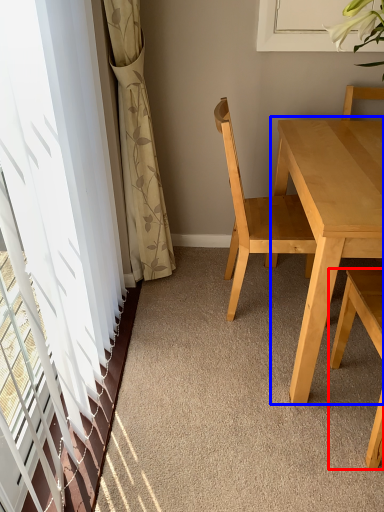
Question: Which of the following is the farthest to the observer, chair (highlighted by a red box) or kitchen & dining room table (highlighted by a blue box)?

Choices:
 (A) chair
 (B) kitchen & dining room table

Answer: (B)